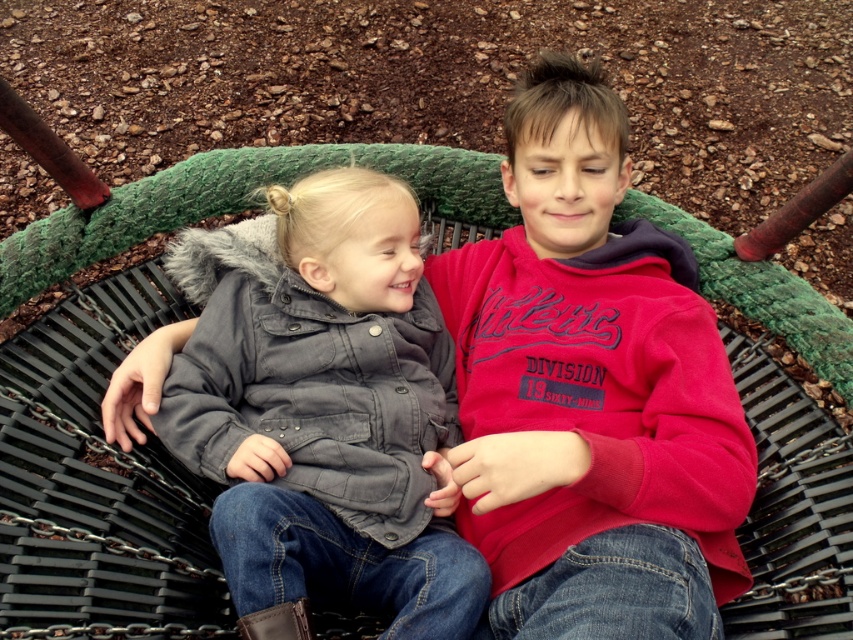
Is matte red hoodie at center shorter than gray matte jacket at center?

No.

Who is more distant from viewer, [589,378] or [312,260]?

The point [312,260] is behind.

Where is `matte red hoodie at center`? This screenshot has height=640, width=853. matte red hoodie at center is located at coordinates (590, 392).